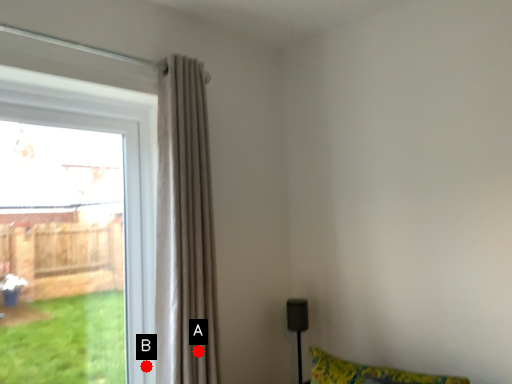
Question: Two points are circled on the image, labeled by A and B beside each circle. Among these points, which one is farthest from the camera?

Choices:
 (A) A is further
 (B) B is further

Answer: (B)